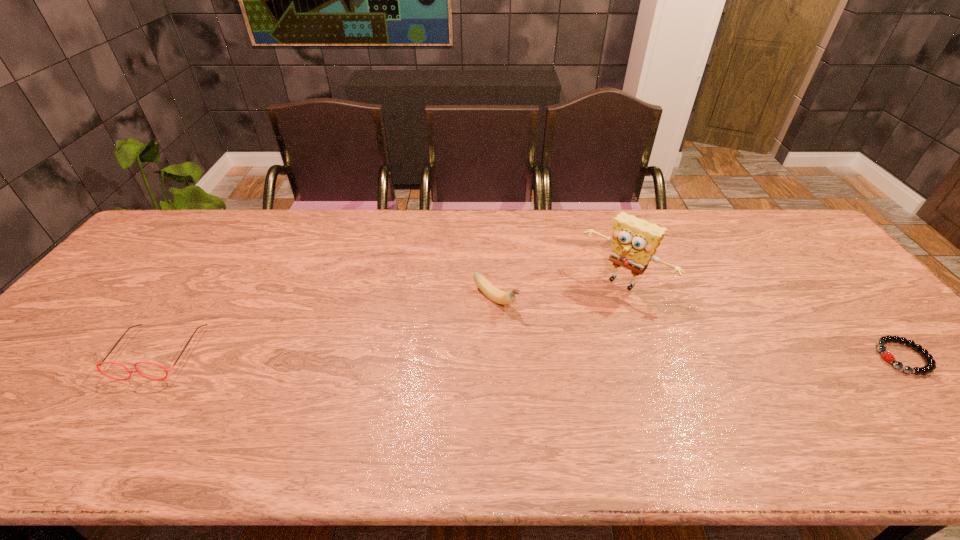
Where is `vacant space at the right edge`? vacant space at the right edge is located at coordinates (792, 267).

Identify the location of vacant space that is in between the shortest object and the banana. (699, 328).

Where is `free space between the shortest object and the second tallest object`? Image resolution: width=960 pixels, height=540 pixels. free space between the shortest object and the second tallest object is located at coordinates click(699, 328).

This screenshot has width=960, height=540. Identify the location of free space between the rightmost object and the leftmost object. (531, 355).

This screenshot has width=960, height=540. Identify the location of free point between the spectacles and the third object from right to left. (327, 326).

Find the location of `free space between the rightmost object and the third shortest object`. free space between the rightmost object and the third shortest object is located at coordinates (699, 328).

This screenshot has width=960, height=540. I want to click on free spot between the rightmost object and the leftmost object, so click(x=531, y=355).

Where is `free space between the tallest object and the shortest object`? This screenshot has height=540, width=960. free space between the tallest object and the shortest object is located at coordinates (763, 320).

Find the location of `empty space between the third shortest object and the bracelet`. empty space between the third shortest object and the bracelet is located at coordinates (699, 328).

Locate an element on the screen. The width and height of the screenshot is (960, 540). vacant space that's between the sponge and the banana is located at coordinates tap(560, 291).